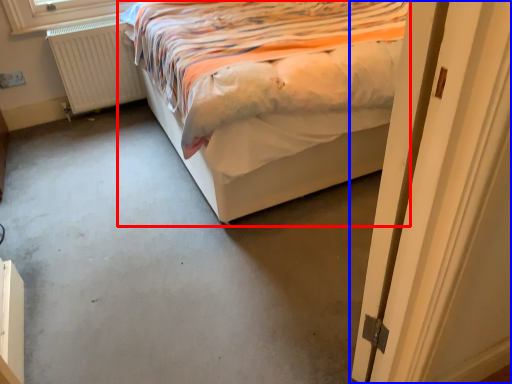
Question: Which point is closer to the camera, bed (highlighted by a red box) or door (highlighted by a blue box)?

Choices:
 (A) bed
 (B) door

Answer: (B)